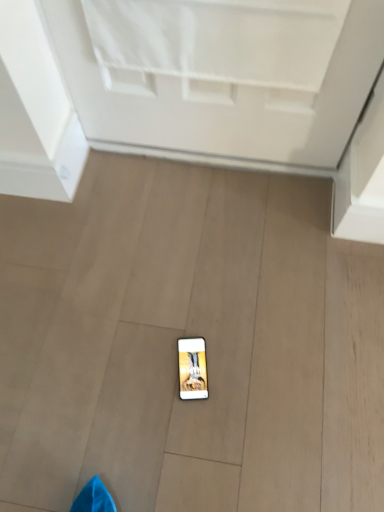
Locate an element on the screen. vacant space to the right of matte black phone at center is located at coordinates (249, 367).